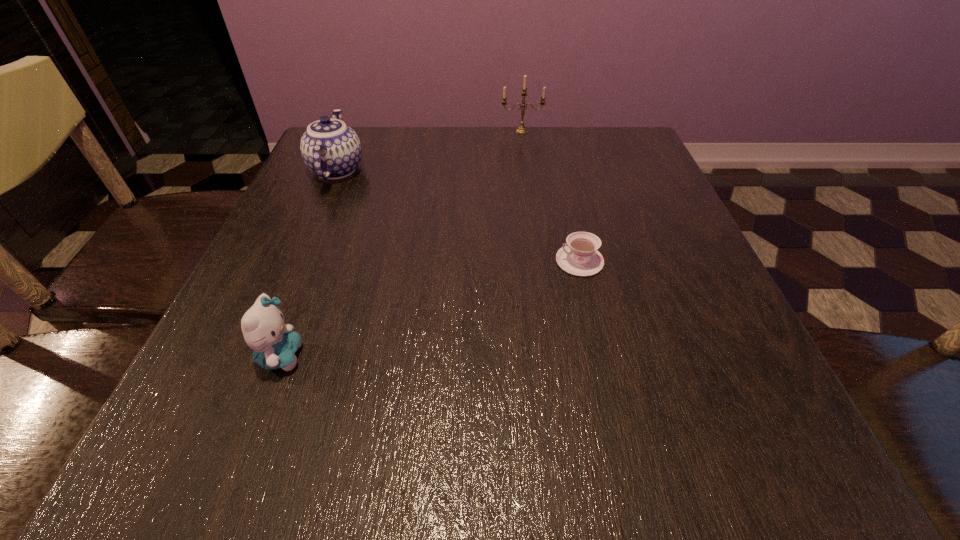
The width and height of the screenshot is (960, 540). In order to click on blank space located on the handle side of the shortest object in this screenshot , I will do `click(428, 261)`.

Identify the location of blank area located 0.310m on the handle side of the shortest object. (384, 261).

Find the location of a particular element. The width and height of the screenshot is (960, 540). candle present at the far edge is located at coordinates (521, 129).

The image size is (960, 540). What are the coordinates of `chinaware that is at the far edge` in the screenshot? It's located at (331, 149).

The width and height of the screenshot is (960, 540). I want to click on chinaware located in the left edge section of the desktop, so click(331, 149).

Where is `kitten located in the left edge section of the desktop`? kitten located in the left edge section of the desktop is located at coordinates (274, 344).

At what (x,y) coordinates should I click in order to perform the action: click on object present at the far left corner. Please return your answer as a coordinate pair (x, y). The height and width of the screenshot is (540, 960). Looking at the image, I should click on (331, 149).

What are the coordinates of `free point at the far edge` in the screenshot? It's located at (432, 148).

The image size is (960, 540). I want to click on vacant space at the near edge of the desktop, so click(x=469, y=475).

Identify the location of vacant space at the left edge of the desktop. (268, 232).